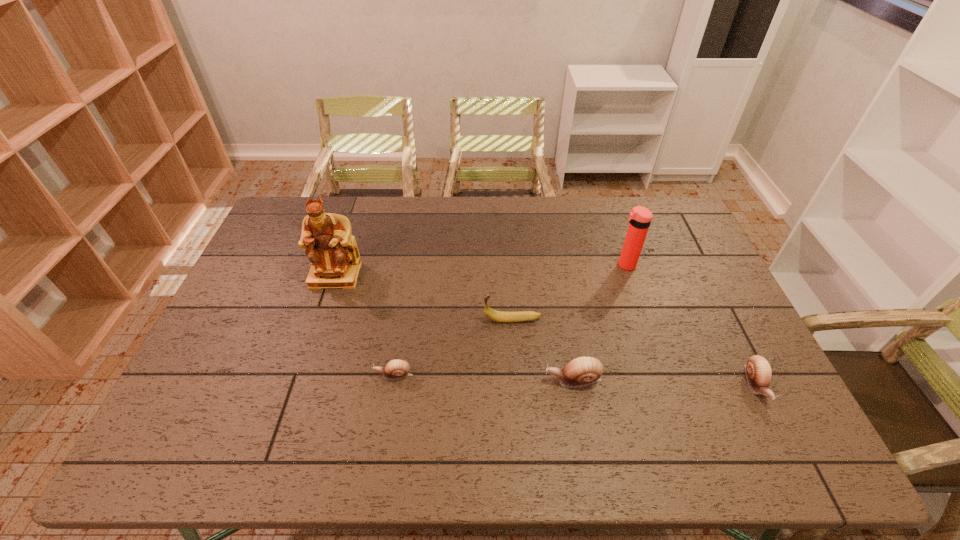
The image size is (960, 540). I want to click on unoccupied area between the tallest object and the fifth object from right to left, so click(x=365, y=325).

Find the location of a particular element. This screenshot has height=540, width=960. vacant area that lies between the banana and the second tallest object is located at coordinates (568, 293).

Locate an element on the screen. free point between the third farthest object and the leftmost escargot is located at coordinates (453, 347).

This screenshot has height=540, width=960. In order to click on vacant area between the rightmost escargot and the fifth object from left to right in this screenshot , I will do `click(690, 325)`.

Image resolution: width=960 pixels, height=540 pixels. Find the location of `empty location between the tallest object and the rightmost object`. empty location between the tallest object and the rightmost object is located at coordinates (545, 330).

This screenshot has width=960, height=540. What are the coordinates of `unoccupied position between the tallest object and the shortest object` in the screenshot? It's located at (365, 325).

Locate an element on the screen. The height and width of the screenshot is (540, 960). free space that is in between the third farthest object and the second escargot from right to left is located at coordinates (542, 350).

Identify which object is the closest to the tallest escargot. Please provide its 2D coordinates. Your answer should be formatted as a tuple, i.e. [(x, y)], where the tuple contains the x and y coordinates of a point satisfying the conditions above.

[(498, 316)]

Select which object appears as the third closest to the rightmost escargot. Please provide its 2D coordinates. Your answer should be formatted as a tuple, i.e. [(x, y)], where the tuple contains the x and y coordinates of a point satisfying the conditions above.

[(498, 316)]

Where is `escargot that is the closest to the tallest escargot`? The height and width of the screenshot is (540, 960). escargot that is the closest to the tallest escargot is located at coordinates pos(395,369).